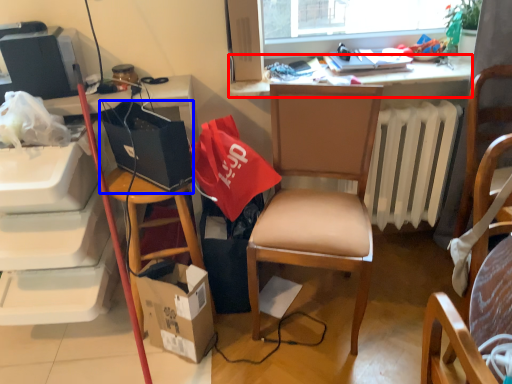
Question: Which object is further to the camera taking this photo, desk (highlighted by a red box) or handbag (highlighted by a blue box)?

Choices:
 (A) desk
 (B) handbag

Answer: (A)